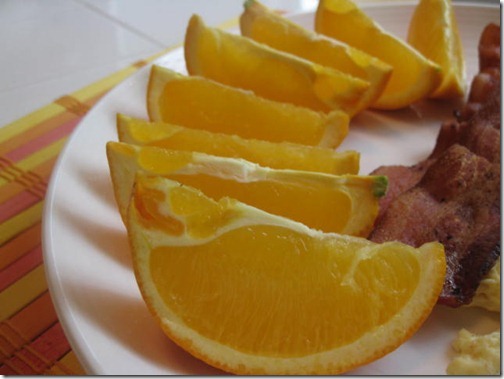
Find the location of a particular element. The height and width of the screenshot is (379, 504). white plate is located at coordinates (96, 282).